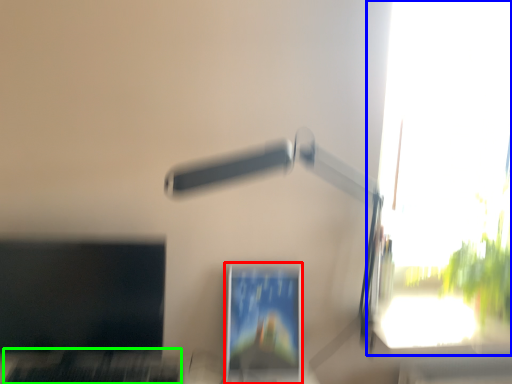
Question: Based on their relative distances, which object is nearer to computer monitor (highlighted by a red box)? Choose from window (highlighted by a blue box) and laptop keyboard (highlighted by a green box).

Choices:
 (A) window
 (B) laptop keyboard

Answer: (B)